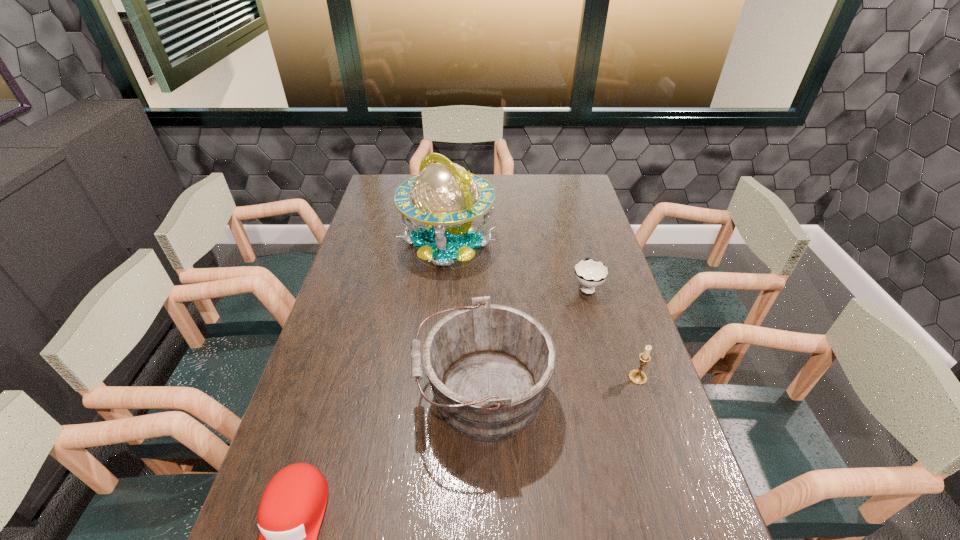
Identify which object is the second closest to the third tallest object. Please provide its 2D coordinates. Your answer should be formatted as a tuple, i.e. [(x, y)], where the tuple contains the x and y coordinates of a point satisfying the conditions above.

[(589, 273)]

Where is `object that can be found as the second closest to the second tallest object`? Image resolution: width=960 pixels, height=540 pixels. object that can be found as the second closest to the second tallest object is located at coordinates (638, 377).